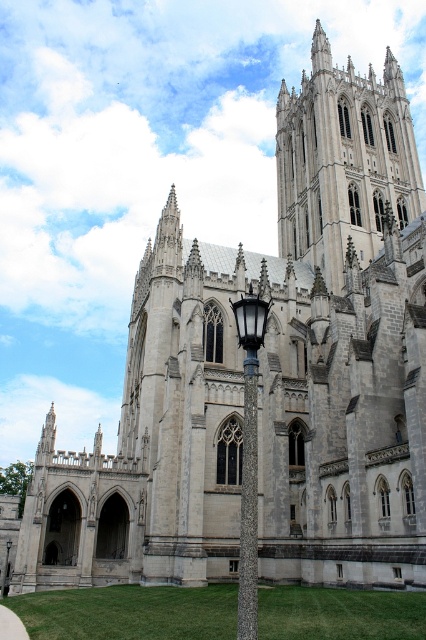
Which is behind, point (365, 200) or point (259, 321)?

Point (365, 200)

Can you confirm if gray stone tower at upper center is positioned to the left of polished brass lamp post at center?

No, gray stone tower at upper center is not to the left of polished brass lamp post at center.

The height and width of the screenshot is (640, 426). Find the location of `gray stone tower at upper center`. gray stone tower at upper center is located at coordinates (342, 161).